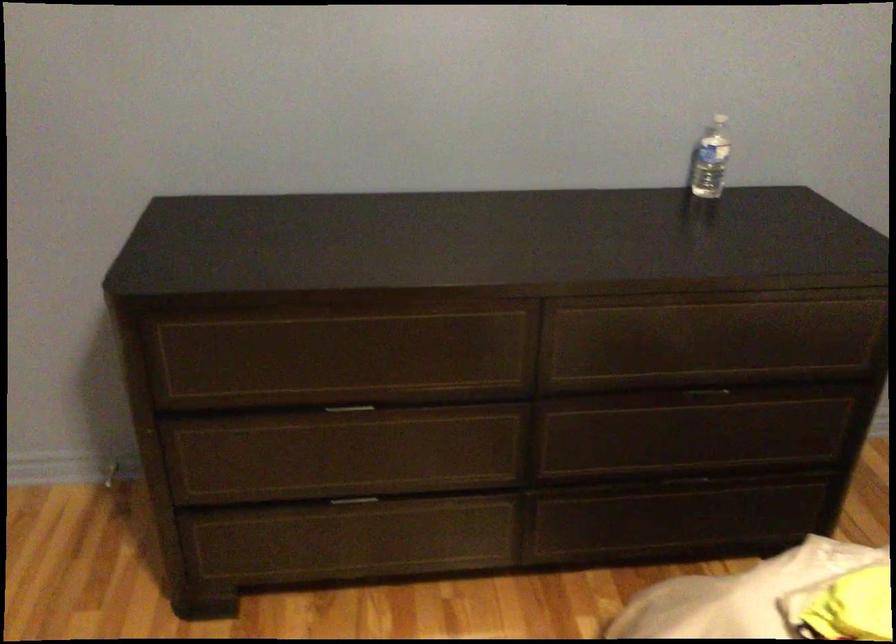
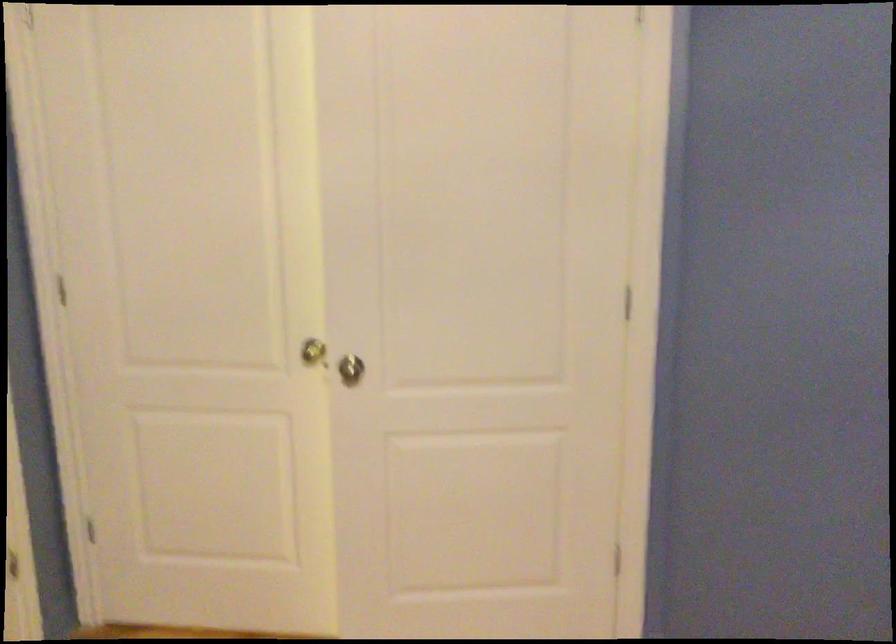
Question: The camera is either moving clockwise (left) or counter-clockwise (right) around the object. The first image is from the beginning of the video and the second image is from the end. Is the camera moving left or right when shooting the video?

Choices:
 (A) Left
 (B) Right

Answer: (B)